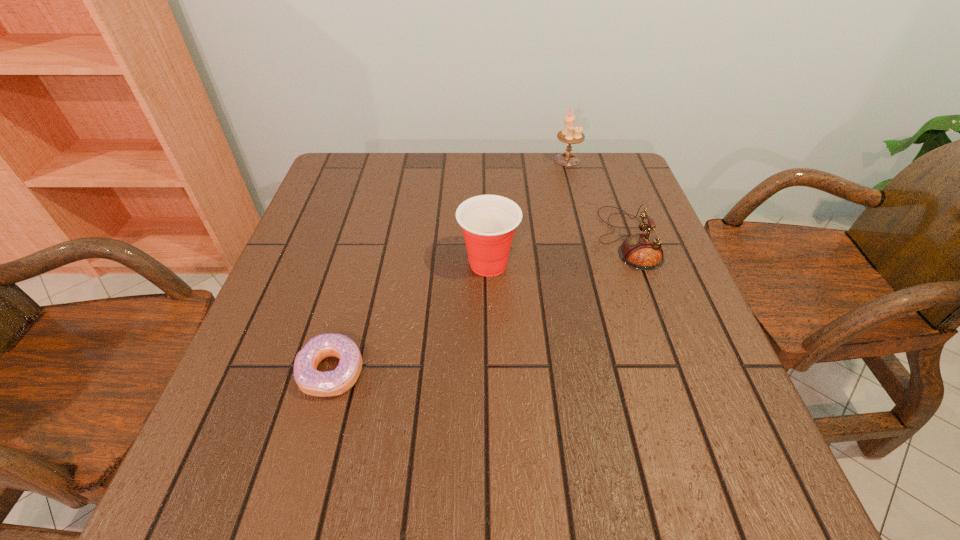
Find the location of a particular element. This screenshot has height=540, width=960. unoccupied position between the shortest object and the farthest object is located at coordinates (449, 266).

Where is `free spot between the third object from right to left and the shortest object`? Image resolution: width=960 pixels, height=540 pixels. free spot between the third object from right to left and the shortest object is located at coordinates (410, 318).

You are a GUI agent. You are given a task and a screenshot of the screen. Output one action in this format:
    pyautogui.click(x=<x>, y=<y>)
    Task: Click on the vacant area that lies between the nearest object and the third object from right to left
    This screenshot has width=960, height=540.
    Given the screenshot: What is the action you would take?
    pyautogui.click(x=410, y=318)

Locate an element on the screen. The width and height of the screenshot is (960, 540). object that ranks as the closest to the shortest object is located at coordinates (488, 222).

The height and width of the screenshot is (540, 960). Identify the location of the closest object to the second shortest object. (488, 222).

Where is `vacant position in the image that satisfies the following two spatial constraints: 1. on the back side of the farthest object; 2. on the right side of the cup`? This screenshot has height=540, width=960. vacant position in the image that satisfies the following two spatial constraints: 1. on the back side of the farthest object; 2. on the right side of the cup is located at coordinates (486, 160).

Identify the location of free space that satisfies the following two spatial constraints: 1. on the rotary dial of the third tallest object; 2. on the front side of the second object from left to right. (636, 264).